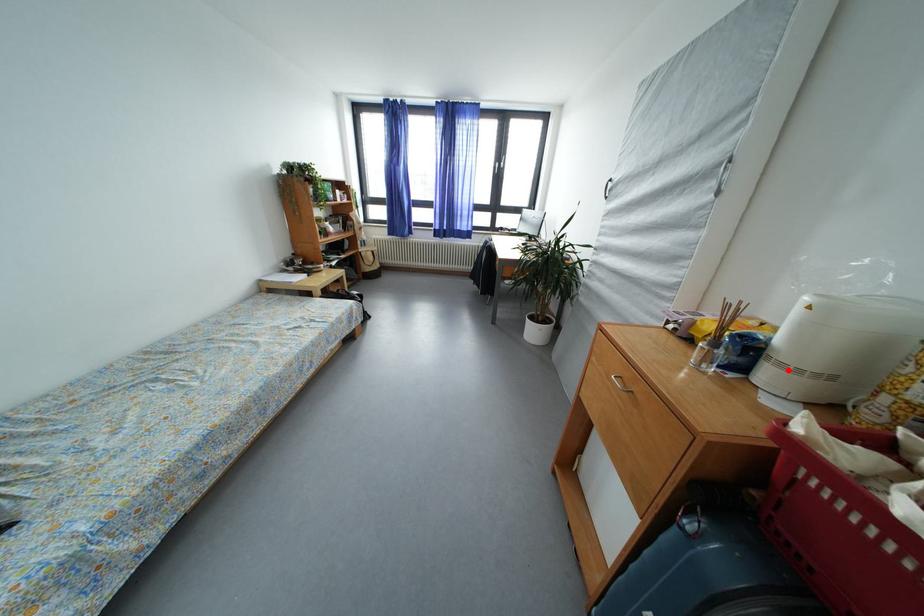
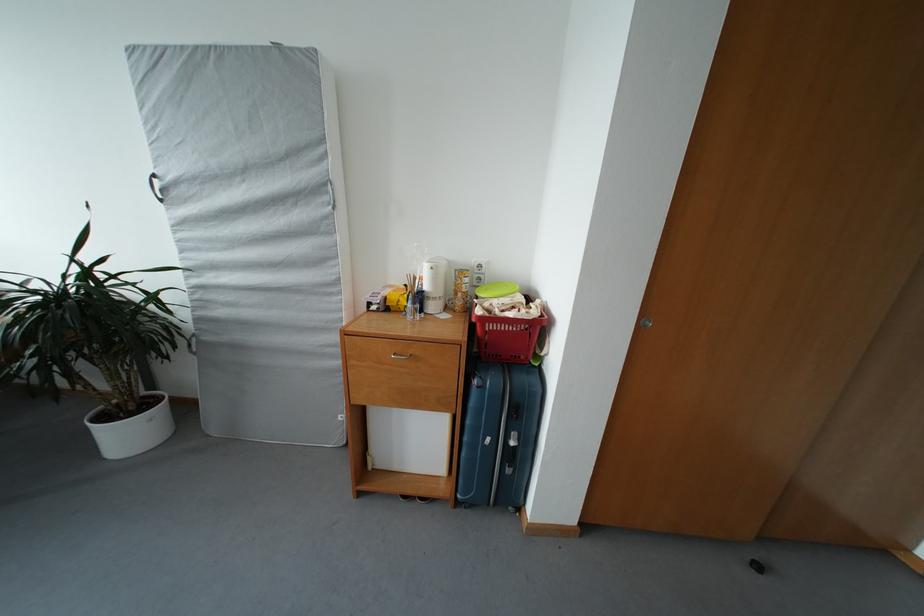
Question: I am providing you with two images of the same scene from different viewpoints. A red point is marked on the first image. At the location where the point appears in image 1, is it still visible in image 2?

Choices:
 (A) Yes
 (B) No

Answer: (A)